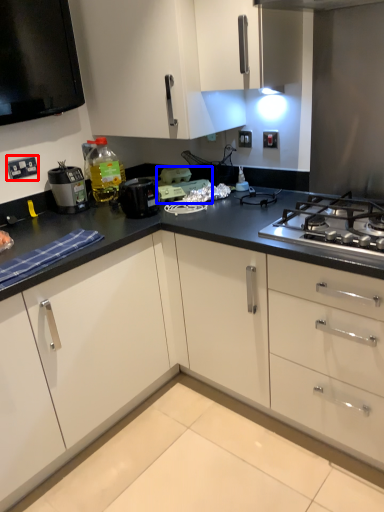
Question: Which object is closer to the camera taking this photo, electric outlet (highlighted by a red box) or appliance (highlighted by a blue box)?

Choices:
 (A) electric outlet
 (B) appliance

Answer: (A)